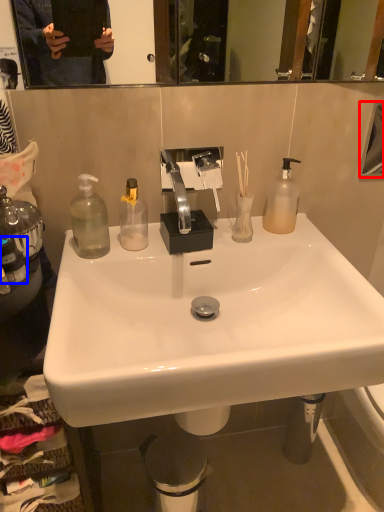
Question: Among these objects, which one is farthest to the camera, mirror (highlighted by a red box) or bottle (highlighted by a blue box)?

Choices:
 (A) mirror
 (B) bottle

Answer: (A)